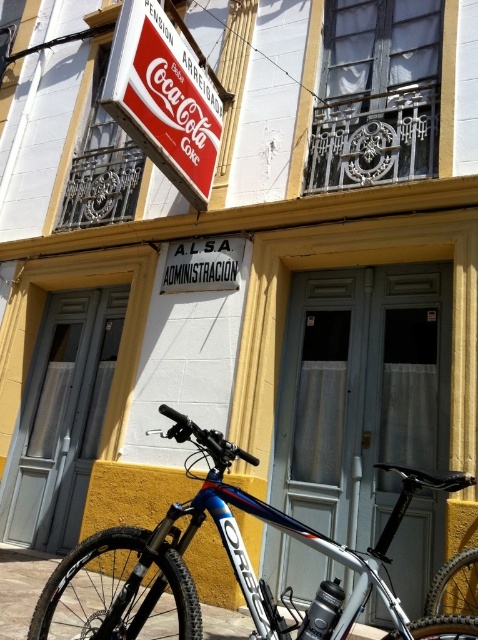
Question: Can you confirm if shiny blue frame at lower center is smaller than red matte coca-cola sign at upper left?

Choices:
 (A) no
 (B) yes

Answer: (A)

Question: Which point appears farthest from the camera in this image?

Choices:
 (A) (162, 166)
 (B) (39, 616)

Answer: (A)

Question: Does shiny blue frame at lower center have a smaller size compared to red matte coca-cola sign at upper left?

Choices:
 (A) no
 (B) yes

Answer: (A)

Question: Observing the image, what is the correct spatial positioning of shiny blue frame at lower center in reference to red matte coca-cola sign at upper left?

Choices:
 (A) left
 (B) right

Answer: (B)

Question: Which of the following is the farthest from the observer?

Choices:
 (A) shiny blue frame at lower center
 (B) red matte coca-cola sign at upper left

Answer: (B)